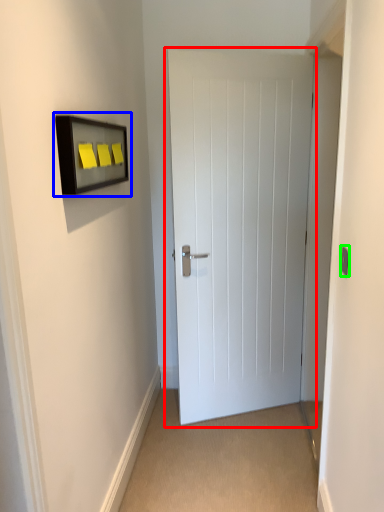
Question: Estimate the real-world distances between objects in this image. Which object is closer to door (highlighted by a red box), medicine cabinet (highlighted by a blue box) or light switch (highlighted by a green box)?

Choices:
 (A) medicine cabinet
 (B) light switch

Answer: (A)